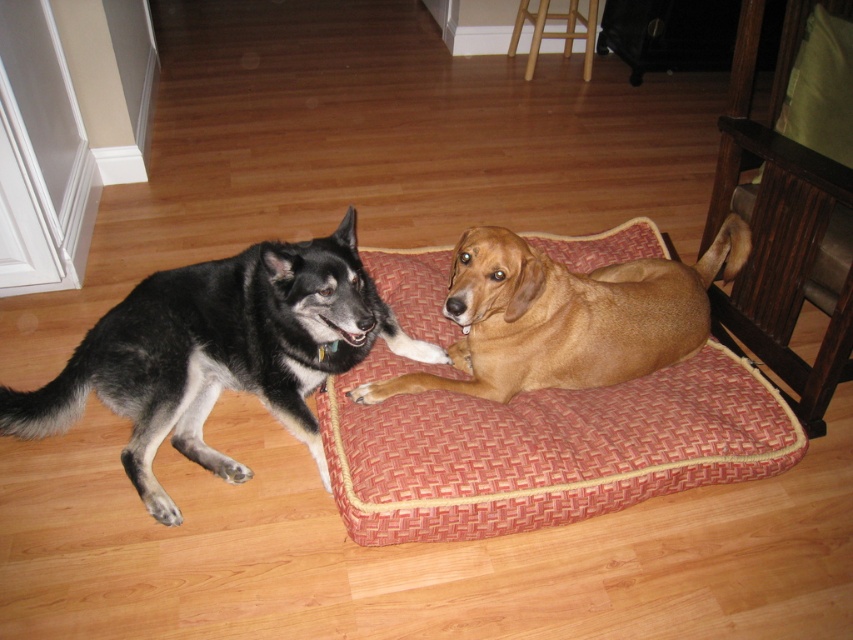
Question: Which of the following is the farthest from the observer?

Choices:
 (A) (691, 432)
 (B) (740, 221)
 (C) (134, 289)

Answer: (B)

Question: Does black fur dog at left come behind brown furry dog at center?

Choices:
 (A) no
 (B) yes

Answer: (B)

Question: Is black fur dog at left positioned behind brown furry dog at center?

Choices:
 (A) no
 (B) yes

Answer: (B)

Question: Does black fur dog at left have a smaller size compared to brown furry dog at center?

Choices:
 (A) yes
 (B) no

Answer: (B)

Question: Which point is closer to the camera?

Choices:
 (A) (184, 349)
 (B) (598, 424)
 (C) (494, 321)

Answer: (C)

Question: Based on their relative distances, which object is nearer to the red woven fabric dog bed at center?

Choices:
 (A) black fur dog at left
 (B) brown furry dog at center

Answer: (B)